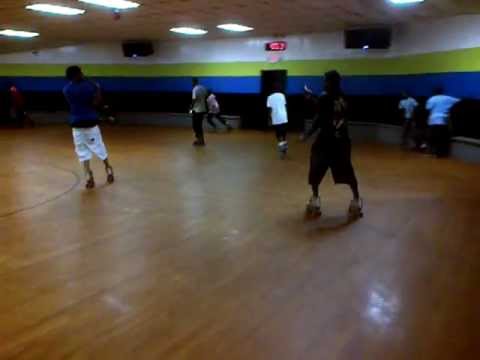
At what (x,y) coordinates should I click in order to perform the action: click on light. Please return your answer as a coordinate pair (x, y). Looking at the image, I should click on [398, 3].